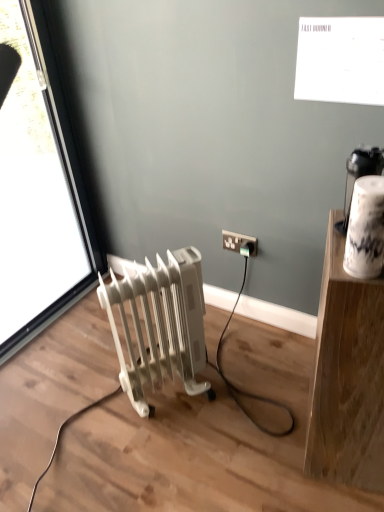
Describe the element at coordinates (161, 323) in the screenshot. I see `white plastic radiator at lower left` at that location.

Image resolution: width=384 pixels, height=512 pixels. I want to click on transparent glass window at left, so (x=38, y=190).

What are the coordinates of `white plastic socket at lower right` in the screenshot? It's located at (240, 243).

Between white plastic radiator at lower left and transparent glass window at left, which one has less height?

white plastic radiator at lower left is shorter.

Can you tell me how much white plastic radiator at lower left and transparent glass window at left differ in facing direction?

The angular difference between white plastic radiator at lower left and transparent glass window at left is 32.1 degrees.

Considering the sizes of objects white plastic radiator at lower left and transparent glass window at left in the image provided, who is smaller, white plastic radiator at lower left or transparent glass window at left?

white plastic radiator at lower left.

Are white plastic radiator at lower left and transparent glass window at left making contact?

No.

Looking at this image, from a real-world perspective, is transparent glass window at left physically located above or below white plastic socket at lower right?

In terms of real-world spatial position, transparent glass window at left is above white plastic socket at lower right.

Consider the image. Which object is closer to the camera taking this photo, transparent glass window at left or white plastic socket at lower right?

Positioned in front is transparent glass window at left.

Who is taller, transparent glass window at left or white plastic socket at lower right?

With more height is transparent glass window at left.

From the image's perspective, is white wood shelf at upper right above or below transparent glass window at left?

Based on their image positions, white wood shelf at upper right is located beneath transparent glass window at left.

Is the depth of white wood shelf at upper right less than that of transparent glass window at left?

Yes, it is in front of transparent glass window at left.

Is transparent glass window at left a part of white wood shelf at upper right?

No, white wood shelf at upper right does not contain transparent glass window at left.

Does white wood shelf at upper right have a lesser width compared to transparent glass window at left?

No, white wood shelf at upper right is not thinner than transparent glass window at left.

From a real-world perspective, is white plastic socket at lower right under transparent glass window at left?

Yes, from a real-world perspective, white plastic socket at lower right is under transparent glass window at left.

At what (x,y) coordinates should I click in order to perform the action: click on window located in front of the white plastic socket at lower right. Please return your answer as a coordinate pair (x, y). The width and height of the screenshot is (384, 512). Looking at the image, I should click on (38, 190).

Consider the image. Is white plastic socket at lower right wider than transparent glass window at left?

In fact, white plastic socket at lower right might be narrower than transparent glass window at left.

Does white plastic socket at lower right appear on the right side of transparent glass window at left?

Yes, white plastic socket at lower right is to the right of transparent glass window at left.

Looking at this image, which object is thinner, transparent glass window at left or white wood shelf at upper right?

transparent glass window at left.

Which point is more distant from viewer, (6, 129) or (373, 328)?

Positioned behind is point (6, 129).

Is transparent glass window at left positioned with its back to white wood shelf at upper right?

No, transparent glass window at left is not facing away from white wood shelf at upper right.

Considering the relative positions of transparent glass window at left and white wood shelf at upper right in the image provided, is transparent glass window at left behind white wood shelf at upper right?

Yes, it is.

Can white wood shelf at upper right be found inside white plastic radiator at lower left?

No, white wood shelf at upper right is not a part of white plastic radiator at lower left.

Between white plastic radiator at lower left and white wood shelf at upper right, which one is positioned in front?

Positioned in front is white wood shelf at upper right.

Is white plastic radiator at lower left positioned with its back to white wood shelf at upper right?

No, white wood shelf at upper right is not at the back of white plastic radiator at lower left.

From a real-world perspective, is white wood shelf at upper right physically above white plastic radiator at lower left?

Yes, from a real-world perspective, white wood shelf at upper right is on top of white plastic radiator at lower left.

Is white wood shelf at upper right turned away from white plastic radiator at lower left?

white wood shelf at upper right does not have its back to white plastic radiator at lower left.

Can you confirm if white wood shelf at upper right is thinner than white plastic radiator at lower left?

No.

Who is taller, white wood shelf at upper right or white plastic radiator at lower left?

white wood shelf at upper right.

I want to click on radiator located on the right of transparent glass window at left, so click(161, 323).

Locate an element on the screen. The height and width of the screenshot is (512, 384). power plugs and sockets below the transparent glass window at left (from the image's perspective) is located at coordinates (240, 243).

Estimate the real-world distances between objects in this image. Which object is closer to white wood shelf at upper right, white plastic socket at lower right or white plastic radiator at lower left?

white plastic radiator at lower left.

Consider the image. When comparing their distances from transparent glass window at left, does white plastic socket at lower right or white wood shelf at upper right seem further?

white wood shelf at upper right is positioned further to the anchor transparent glass window at left.

When comparing their distances from white plastic radiator at lower left, does transparent glass window at left or white plastic socket at lower right seem further?

transparent glass window at left lies further to white plastic radiator at lower left than the other object.

Looking at the image, which one is located closer to white plastic radiator at lower left, white wood shelf at upper right or white plastic socket at lower right?

white plastic socket at lower right.

Based on their spatial positions, is white plastic socket at lower right or white wood shelf at upper right further from white plastic radiator at lower left?

white wood shelf at upper right is positioned further to the anchor white plastic radiator at lower left.

Based on their spatial positions, is white plastic radiator at lower left or white plastic socket at lower right closer to white wood shelf at upper right?

white plastic radiator at lower left lies closer to white wood shelf at upper right than the other object.

Based on their spatial positions, is transparent glass window at left or white wood shelf at upper right closer to white plastic socket at lower right?

white wood shelf at upper right is positioned closer to the anchor white plastic socket at lower right.

When comparing their distances from white wood shelf at upper right, does transparent glass window at left or white plastic radiator at lower left seem closer?

white plastic radiator at lower left is closer to white wood shelf at upper right.

Locate an element on the screen. radiator between transparent glass window at left and white wood shelf at upper right is located at coordinates pyautogui.click(x=161, y=323).

The width and height of the screenshot is (384, 512). In order to click on radiator positioned between white wood shelf at upper right and white plastic socket at lower right from near to far in this screenshot , I will do `click(161, 323)`.

Identify the location of power plugs and sockets located between transparent glass window at left and white wood shelf at upper right in the left-right direction. (240, 243).

This screenshot has width=384, height=512. What are the coordinates of `radiator situated between transparent glass window at left and white plastic socket at lower right from left to right` in the screenshot? It's located at (161, 323).